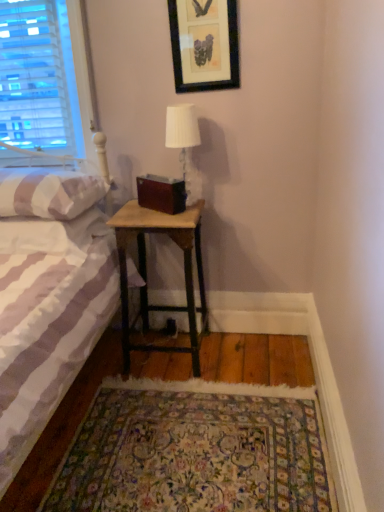
Question: Is white fabric lampshade at upper center in front of or behind white striped fabric bed at left in the image?

Choices:
 (A) behind
 (B) front

Answer: (A)

Question: Considering the positions of white fabric lampshade at upper center and white striped fabric bed at left in the image, is white fabric lampshade at upper center bigger or smaller than white striped fabric bed at left?

Choices:
 (A) big
 (B) small

Answer: (B)

Question: Estimate the real-world distances between objects in this image. Which object is closer to the floral carpet at lower center?

Choices:
 (A) white striped pillow at left
 (B) white striped fabric bed at left
 (C) white fabric lampshade at upper center
 (D) woodenmaterial/texturenightstand at lower center
 (E) black framed picture at upper center

Answer: (D)

Question: Based on their relative distances, which object is farther from the black framed picture at upper center?

Choices:
 (A) white striped fabric bed at left
 (B) woodenmaterial/texturenightstand at lower center
 (C) white fabric lampshade at upper center
 (D) white striped pillow at left
 (E) floral carpet at lower center

Answer: (E)